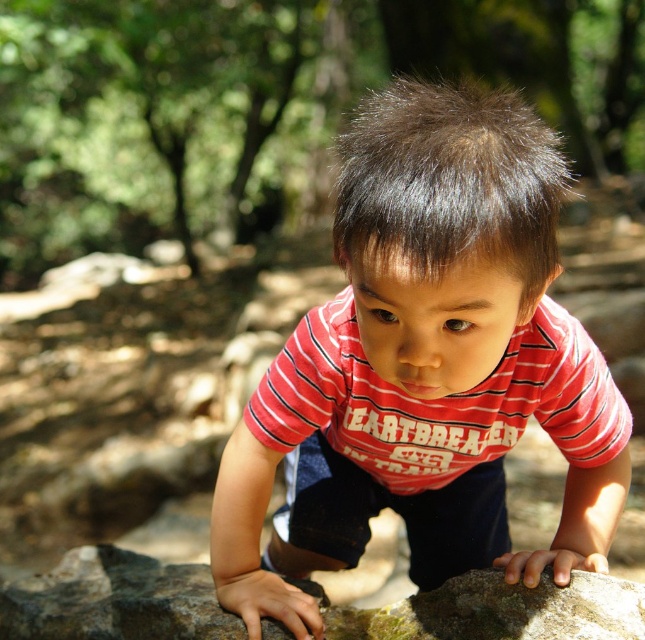
You are a photographer trying to capture a closeup of the red striped shirt at center and the green mossy rock at center. The camera can focus on objects within a 10 inch range. Will both objects be in focus?

The red striped shirt at center is 10.38 inches from the green mossy rock at center. Since the distance between them is slightly over 10 inches, the camera might not be able to keep both in focus simultaneously.

Based on the photo, you are a photographer trying to capture the exact position of the child in the image. According to the coordinates provided, where is the red striped shirt at center located?

The red striped shirt at center is located at coordinates point (424, 368).

You are a photographer standing at a certain distance from the child wearing the red striped shirt at center. You want to take a closeup shot of the shirt. Based on the given information, is the current distance sufficient to capture a clear closeup without needing to move closer?

The distance between the red striped shirt at center and the viewer is 23.82 inches. Whether this is sufficient for a clear closeup depends on the camera lens. A standard camera typically requires a minimum focus distance of about 12 inches for closeups. Since 23.82 inches is greater than 12 inches, the photographer can capture a clear closeup without moving closer.